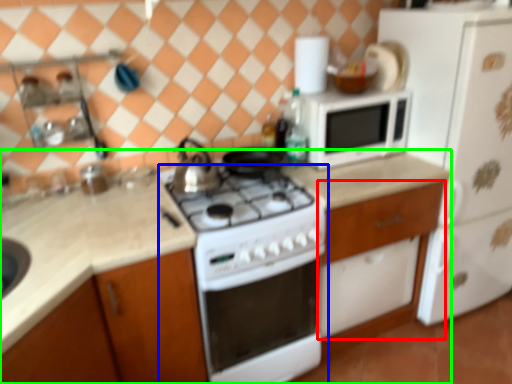
Question: Considering the real-world distances, which object is closest to cabinetry (highlighted by a red box)? home appliance (highlighted by a blue box) or countertop (highlighted by a green box).

Choices:
 (A) home appliance
 (B) countertop

Answer: (A)